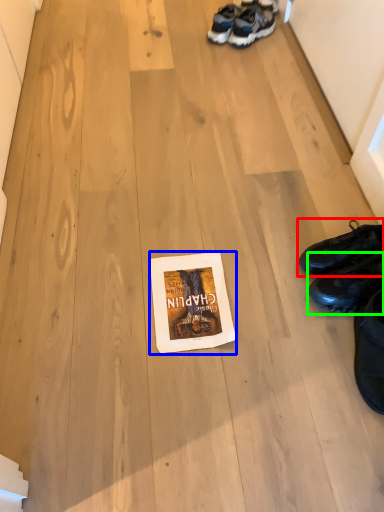
Question: Which object is the farthest from footwear (highlighted by a red box)? Choose among these: paperback book (highlighted by a blue box) or footwear (highlighted by a green box).

Choices:
 (A) paperback book
 (B) footwear

Answer: (A)